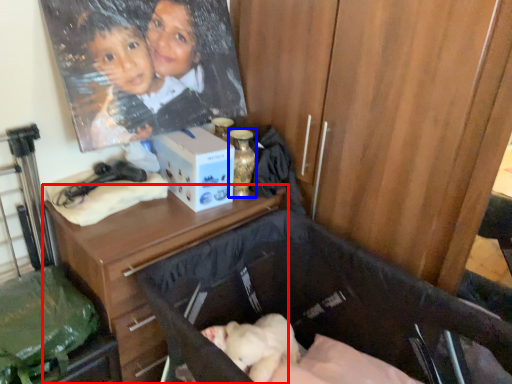
Question: Which of the following is the farthest to the observer, desk (highlighted by a red box) or bottle (highlighted by a blue box)?

Choices:
 (A) desk
 (B) bottle

Answer: (B)